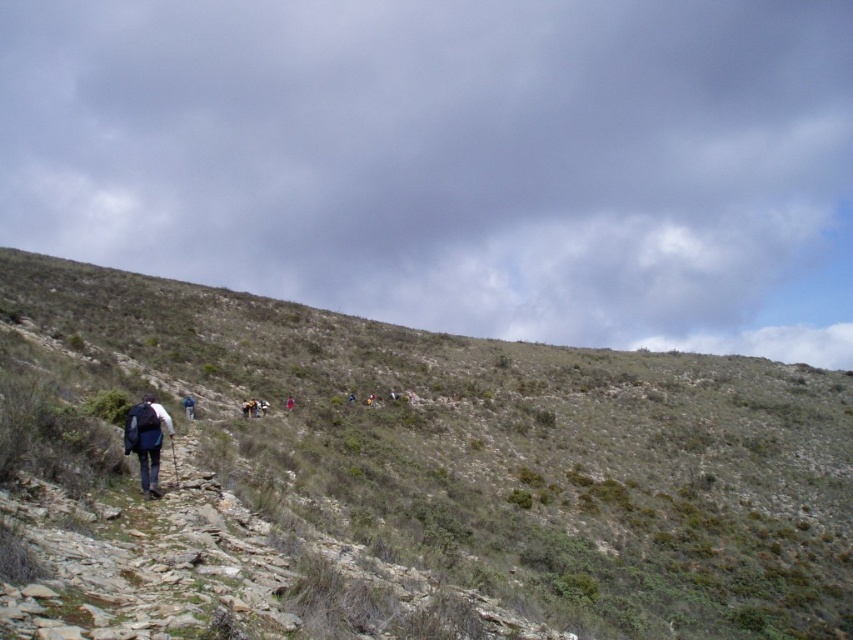
Who is positioned more to the right, dark blue backpack at lower left or blue fabric jacket at lower left?

dark blue backpack at lower left

Is point (155, 426) farther from camera compared to point (190, 397)?

No.

The image size is (853, 640). In order to click on dark blue backpack at lower left in this screenshot , I will do `click(146, 440)`.

The image size is (853, 640). Identify the location of dark blue backpack at lower left. (146, 440).

From the picture: Does green grassy hillside at center have a smaller size compared to dark blue backpack at lower left?

No.

Based on the photo, can you confirm if green grassy hillside at center is shorter than dark blue backpack at lower left?

Incorrect, green grassy hillside at center's height does not fall short of dark blue backpack at lower left's.

Does point (556, 579) come behind point (131, 432)?

Yes.

Find the location of a particular element. green grassy hillside at center is located at coordinates (506, 452).

Who is taller, green grassy hillside at center or blue fabric jacket at lower left?

Standing taller between the two is green grassy hillside at center.

How distant is green grassy hillside at center from blue fabric jacket at lower left?

They are 154.89 feet apart.

Between point (807, 561) and point (193, 412), which one is positioned behind?

The point (807, 561) is behind.

Where is `green grassy hillside at center`? green grassy hillside at center is located at coordinates (506, 452).